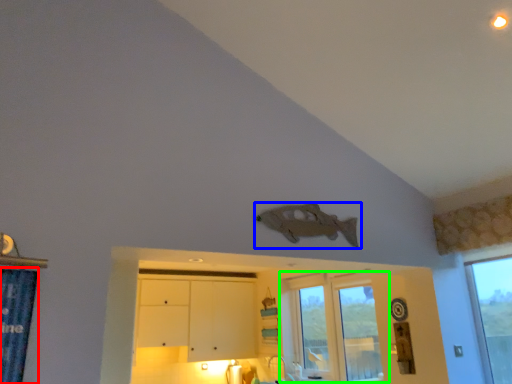
Question: Considering the real-world distances, which object is closest to shower curtain (highlighted by a red box)? fish (highlighted by a blue box) or window (highlighted by a green box).

Choices:
 (A) fish
 (B) window

Answer: (A)